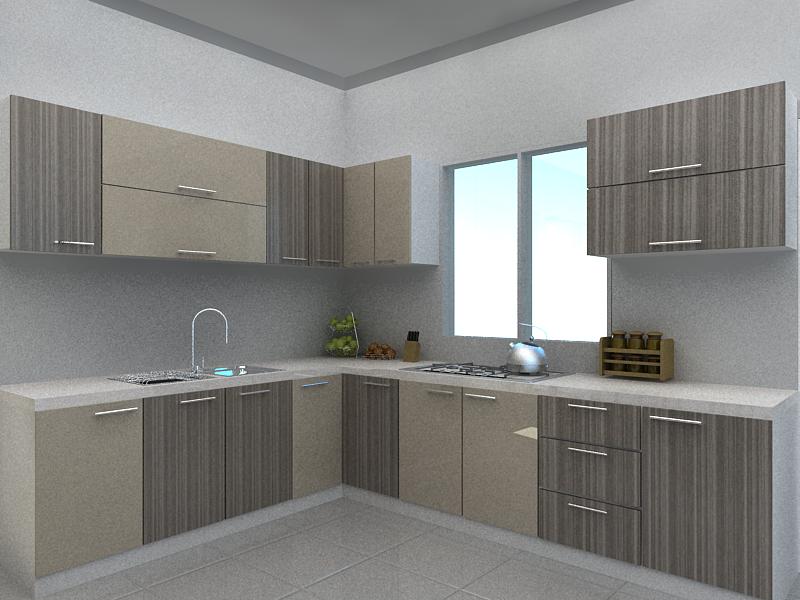
Where is `teapot`? The width and height of the screenshot is (800, 600). teapot is located at coordinates (534, 361).